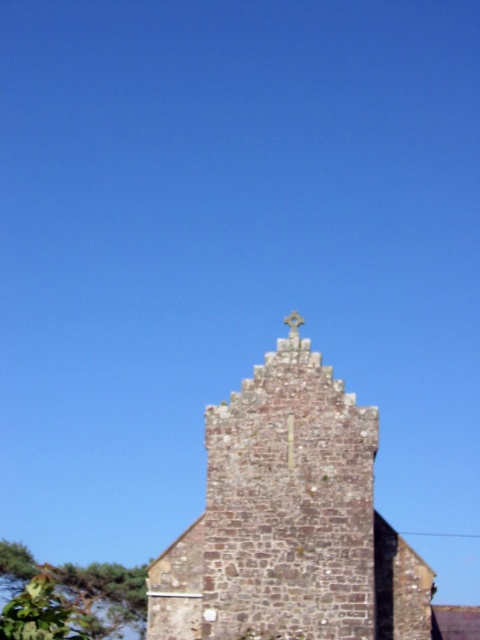
Question: Where is brown stone tower at center located in relation to white stone cross at center in the image?

Choices:
 (A) left
 (B) right

Answer: (A)

Question: Is brown stone tower at center smaller than white stone cross at center?

Choices:
 (A) yes
 (B) no

Answer: (B)

Question: From the image, what is the correct spatial relationship of brown stone tower at center in relation to white stone cross at center?

Choices:
 (A) above
 (B) below

Answer: (B)